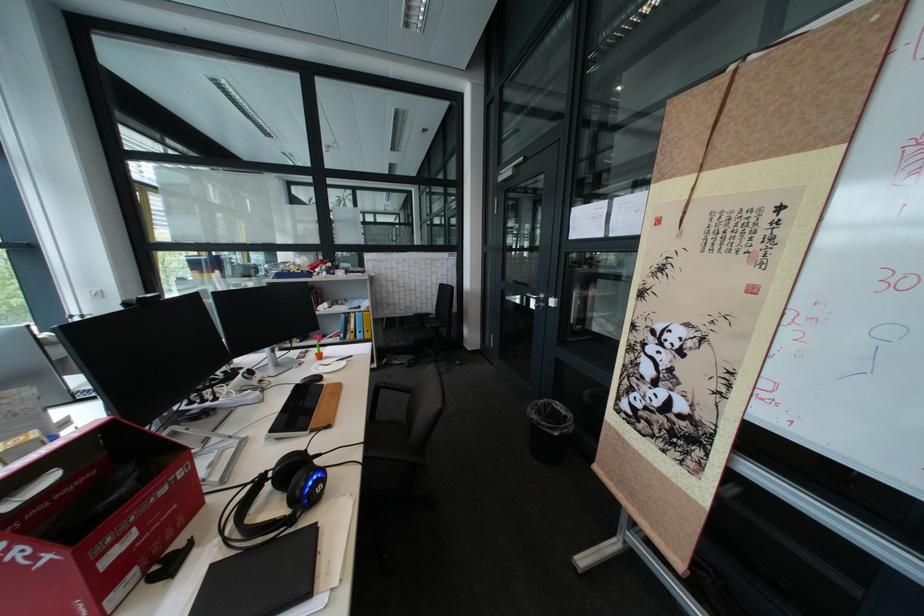
Find where to resting arm the black chair armrest. Please return your answer as a coordinate pair (x, y).

(416, 395)